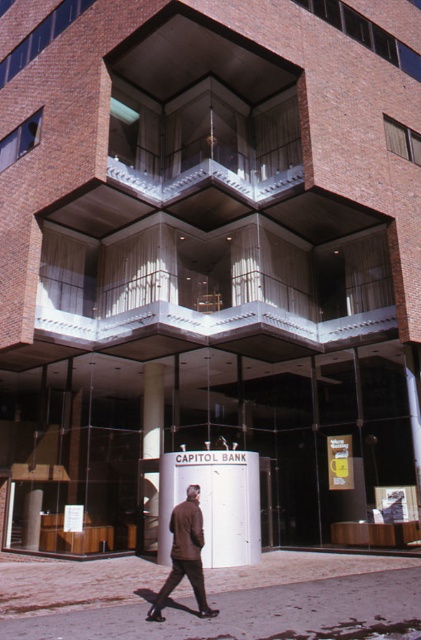
Question: Among these points, which one is farthest from the camera?

Choices:
 (A) (157, 440)
 (B) (170, 522)
 (C) (37, 582)

Answer: (A)

Question: Which point is farther to the camera?

Choices:
 (A) (173, 568)
 (B) (149, 490)

Answer: (B)

Question: Is smooth concrete pavement at lower center positioned at the back of white glossy pillar at center?

Choices:
 (A) no
 (B) yes

Answer: (A)

Question: Which of the following is the farthest from the observer?

Choices:
 (A) brown leather jacket at lower center
 (B) white glossy pillar at center

Answer: (B)

Question: Is the position of smooth concrete pavement at lower center more distant than that of brown leather jacket at lower center?

Choices:
 (A) yes
 (B) no

Answer: (B)

Question: Is the position of white glossy pillar at center more distant than that of brown leather jacket at lower center?

Choices:
 (A) yes
 (B) no

Answer: (A)